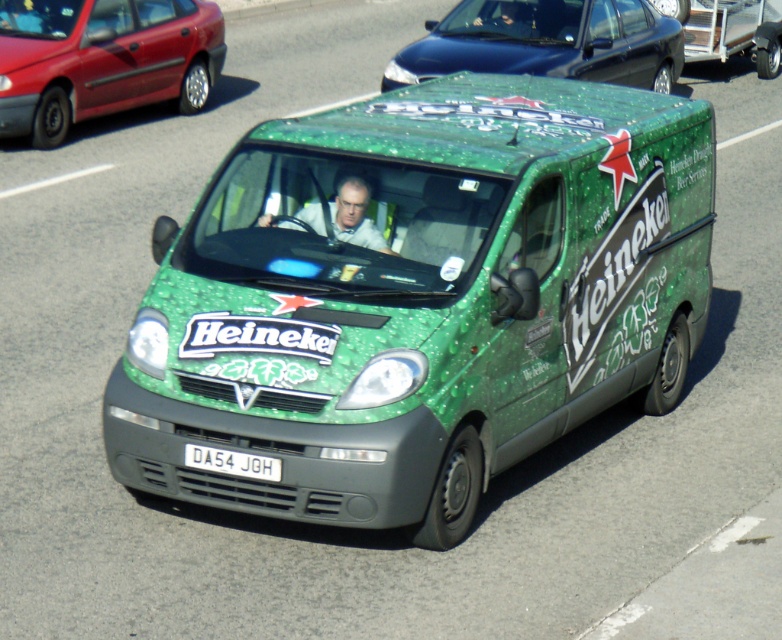
You are a delivery driver in a shiny black sedan at upper center and need to pass by the white matte shirt at center. Can your sedan fit through the space without touching the shirt?

The shiny black sedan at upper center is bigger than the white matte shirt at center. Since the sedan is larger, it may not fit through the space without adjusting its path or reducing speed to avoid contact with the shirt.

You are a delivery driver in a shiny black sedan at upper center and need to pass by the white matte shirt at center. Can your sedan fit through the space next to the shirt?

The shiny black sedan at upper center is wider than the white matte shirt at center, so it may not fit through the space next to the shirt unless there is sufficient clearance. However, since the exact dimensions of the space are not provided, it is recommended to proceed cautiously.

You are a pedestrian standing at the side of the road. You see a metallic red sedan at upper left and a white plastic license plate at center. How far apart are these two objects from each other?

The metallic red sedan at upper left is 10.31 meters away from the white plastic license plate at center.